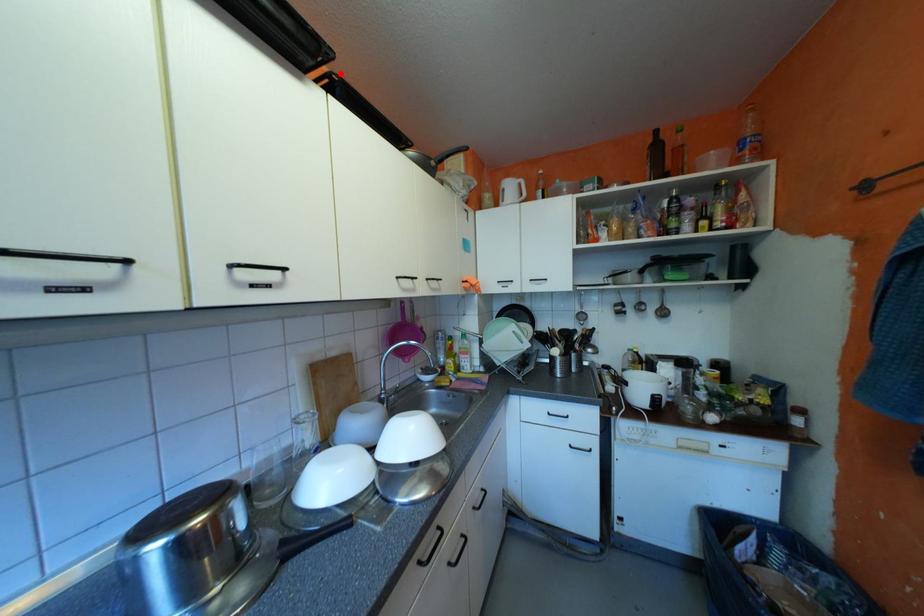
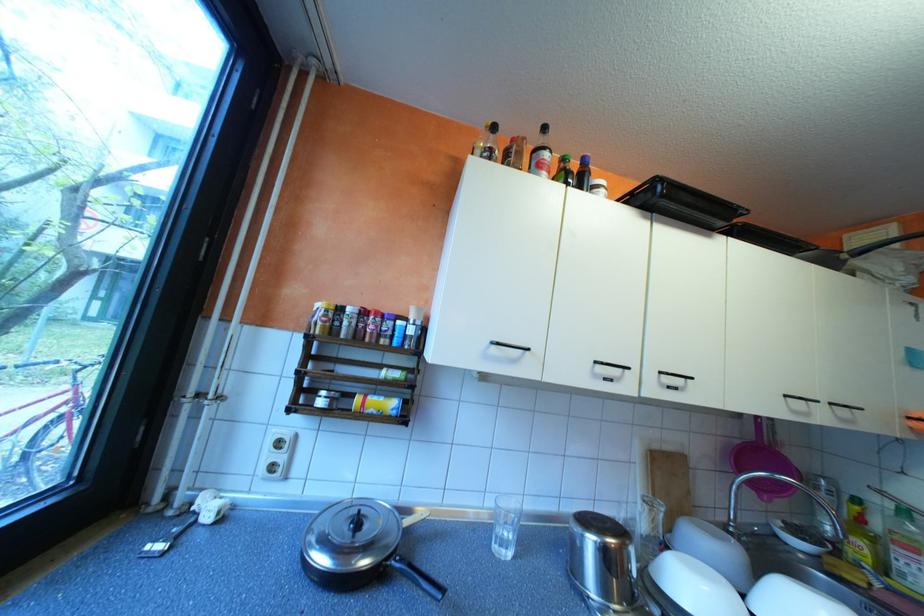
In the second image, find the point that corresponds to the highlighted location in the first image.

(745, 224)